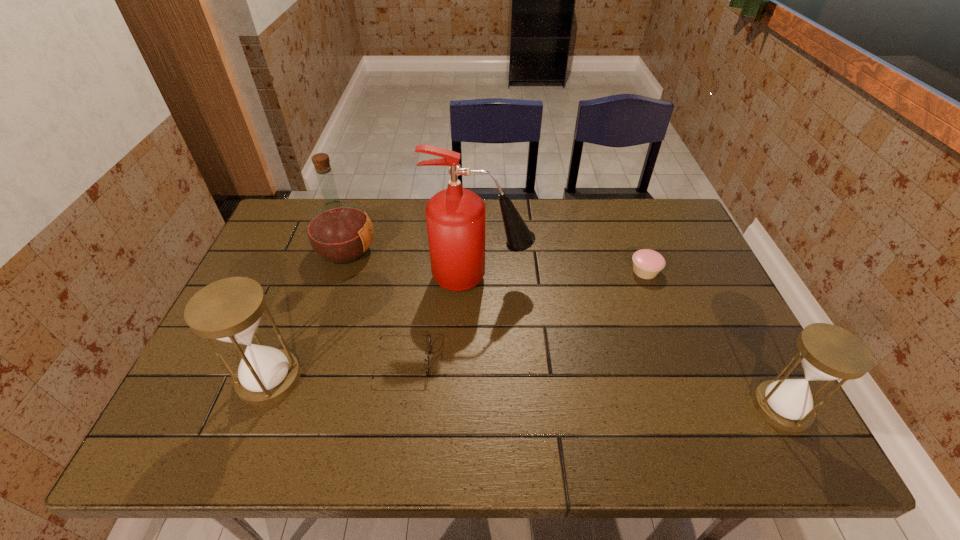
The height and width of the screenshot is (540, 960). I want to click on free space that is in between the sunglasses and the taller hourglass, so click(337, 370).

The image size is (960, 540). In order to click on empty space that is in between the shorter hourglass and the fourth shortest object in this screenshot , I will do `click(525, 393)`.

This screenshot has height=540, width=960. I want to click on free space between the shortest object and the tallest object, so click(442, 320).

At what (x,y) coordinates should I click in order to perform the action: click on vacant area that lies between the liquor and the taller hourglass. Please return your answer as a coordinate pair (x, y). Looking at the image, I should click on (308, 315).

At what (x,y) coordinates should I click in order to perform the action: click on vacant area that lies between the shortest object and the taller hourglass. Please return your answer as a coordinate pair (x, y). Looking at the image, I should click on (337, 370).

The image size is (960, 540). What are the coordinates of `vacant space in between the fire extinguisher and the shorter hourglass` in the screenshot? It's located at (631, 342).

Where is `unoccupied area between the third tallest object and the tallest object`? The height and width of the screenshot is (540, 960). unoccupied area between the third tallest object and the tallest object is located at coordinates (374, 328).

I want to click on free point between the fire extinguisher and the second shortest object, so click(563, 274).

Locate an element on the screen. This screenshot has width=960, height=540. unoccupied area between the right hourglass and the fifth shortest object is located at coordinates (564, 329).

This screenshot has width=960, height=540. Find the location of `free spot between the tallest object and the liquor`. free spot between the tallest object and the liquor is located at coordinates (413, 264).